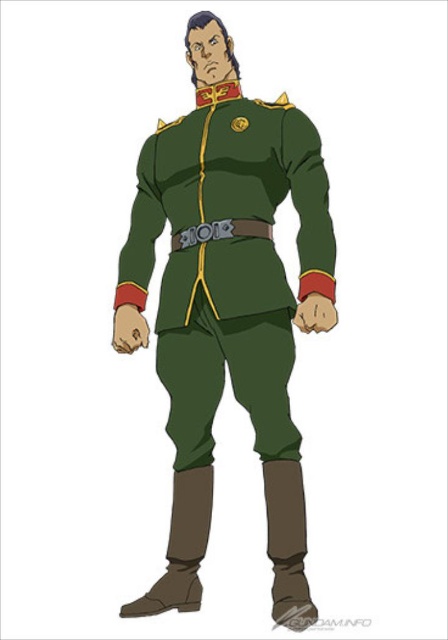
Question: Observing the image, what is the correct spatial positioning of green matte uniform at center in reference to green leather belt at center?

Choices:
 (A) left
 (B) right

Answer: (B)

Question: Can you confirm if green matte uniform at center is wider than green leather belt at center?

Choices:
 (A) yes
 (B) no

Answer: (A)

Question: Which point is closer to the camera taking this photo?

Choices:
 (A) (267, 230)
 (B) (181, 483)

Answer: (B)

Question: Which of the following is the farthest from the observer?

Choices:
 (A) (233, 336)
 (B) (248, 228)

Answer: (B)

Question: Is green matte uniform at center below green leather belt at center?

Choices:
 (A) no
 (B) yes

Answer: (B)